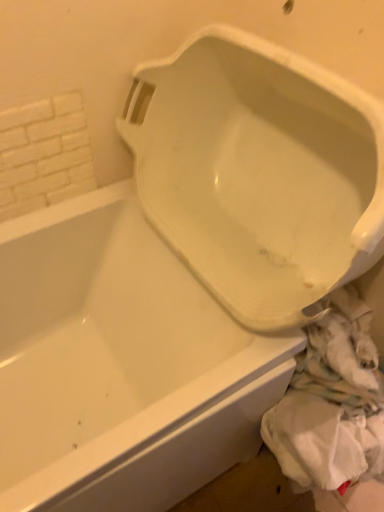
What are the coordinates of `white fabric at lower right` in the screenshot? It's located at (331, 403).

Describe the element at coordinates (44, 154) in the screenshot. I see `white brick wall at upper left` at that location.

What are the coordinates of `white glossy urinal at center` in the screenshot? It's located at (259, 173).

This screenshot has width=384, height=512. Identify the location of white fabric at lower right. (331, 403).

Are white glossy urinal at center and white brick wall at upper left making contact?

white glossy urinal at center and white brick wall at upper left are not in contact.

Looking at this image, could you tell me if white glossy urinal at center is turned towards white brick wall at upper left?

Yes, white glossy urinal at center is aimed at white brick wall at upper left.

From a real-world perspective, is white glossy urinal at center physically above white brick wall at upper left?

No, from a real-world perspective, white glossy urinal at center is not on top of white brick wall at upper left.

From the image's perspective, which is below, white glossy urinal at center or white brick wall at upper left?

white glossy urinal at center appears lower in the image.

Between white fabric at lower right and white glossy urinal at center, which one has more height?

With more height is white glossy urinal at center.

Is white fabric at lower right behind white glossy urinal at center?

That is True.

Locate an element on the screen. Image resolution: width=384 pixels, height=512 pixels. material lying on the right of white glossy urinal at center is located at coordinates (331, 403).

Visually, is white fabric at lower right positioned to the left or to the right of white glossy urinal at center?

Based on their positions, white fabric at lower right is located to the right of white glossy urinal at center.

Which object is further away from the camera taking this photo, white brick wall at upper left or white glossy urinal at center?

white brick wall at upper left is further from the camera.

Which is further, (3, 112) or (299, 248)?

Point (299, 248)

Is white glossy urinal at center surrounded by white brick wall at upper left?

No, white glossy urinal at center is not a part of white brick wall at upper left.

Would you say white brick wall at upper left is to the left or to the right of white glossy urinal at center in the picture?

From the image, it's evident that white brick wall at upper left is to the left of white glossy urinal at center.

From a real-world perspective, is white brick wall at upper left physically below white fabric at lower right?

Actually, white brick wall at upper left is physically above white fabric at lower right in the real world.

Do you think white brick wall at upper left is within white fabric at lower right, or outside of it?

white brick wall at upper left is outside white fabric at lower right.

This screenshot has height=512, width=384. Identify the location of tile on the left side of white fabric at lower right. (44, 154).

Can you confirm if white brick wall at upper left is bigger than white fabric at lower right?

No.

Is white glossy urinal at center far from white fabric at lower right?

white glossy urinal at center is near white fabric at lower right, not far away.

Is white glossy urinal at center inside or outside of white fabric at lower right?

white glossy urinal at center is outside white fabric at lower right.

In the scene shown: From a real-world perspective, is white glossy urinal at center physically located above or below white fabric at lower right?

Clearly, from a real-world perspective, white glossy urinal at center is above white fabric at lower right.

Is white fabric at lower right placed right next to white brick wall at upper left?

No, white fabric at lower right is not with white brick wall at upper left.

Consider the image. From a real-world perspective, between white fabric at lower right and white brick wall at upper left, who is vertically higher?

white brick wall at upper left.

Looking at this image, who is more distant, white fabric at lower right or white brick wall at upper left?

white fabric at lower right is further away from the camera.

Locate an element on the screen. This screenshot has height=512, width=384. urinal lying below the white brick wall at upper left (from the image's perspective) is located at coordinates point(259,173).

Find the location of `urinal above the white fabric at lower right (from the image's perspective)`. urinal above the white fabric at lower right (from the image's perspective) is located at coordinates (259, 173).

From the image, which object appears to be nearer to white brick wall at upper left, white glossy urinal at center or white fabric at lower right?

white glossy urinal at center.

Considering their positions, is white fabric at lower right positioned further to white brick wall at upper left than white glossy urinal at center?

white fabric at lower right lies further to white brick wall at upper left than the other object.

Based on their spatial positions, is white glossy urinal at center or white brick wall at upper left further from white fabric at lower right?

Among the two, white brick wall at upper left is located further to white fabric at lower right.

Considering their positions, is white brick wall at upper left positioned further to white fabric at lower right than white glossy urinal at center?

white brick wall at upper left lies further to white fabric at lower right than the other object.

Looking at the image, which one is located further to white glossy urinal at center, white fabric at lower right or white brick wall at upper left?

Based on the image, white brick wall at upper left appears to be further to white glossy urinal at center.

Which object lies nearer to the anchor point white glossy urinal at center, white brick wall at upper left or white fabric at lower right?

white fabric at lower right.

The image size is (384, 512). In order to click on urinal between white brick wall at upper left and white fabric at lower right vertically in this screenshot , I will do `click(259, 173)`.